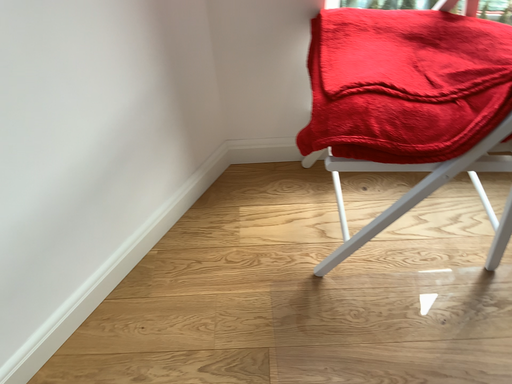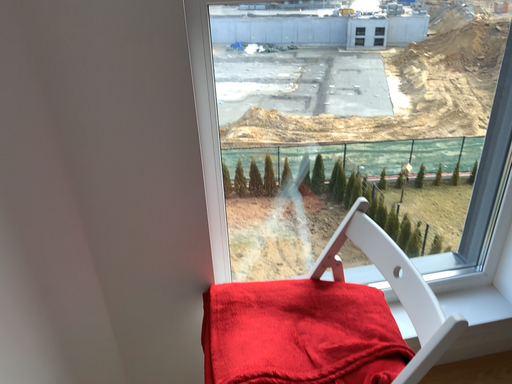
Question: Which way did the camera rotate in the video?

Choices:
 (A) rotated upward
 (B) rotated downward

Answer: (A)